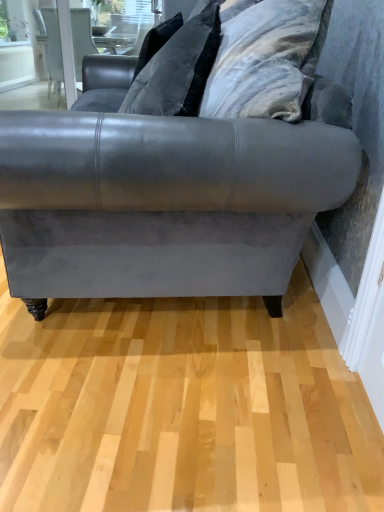
This screenshot has height=512, width=384. Identify the location of velvet gray couch at center. (162, 202).

What do you see at coordinates (162, 202) in the screenshot?
I see `velvet gray couch at center` at bounding box center [162, 202].

Measure the distance between velvet gray couch at center and camera.

A distance of 37.50 inches exists between velvet gray couch at center and camera.

Where is `velvet gray couch at center`? The width and height of the screenshot is (384, 512). velvet gray couch at center is located at coordinates (162, 202).